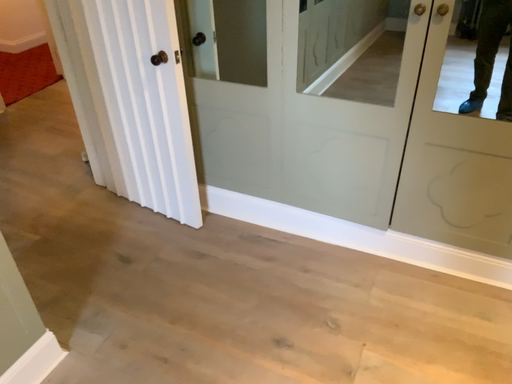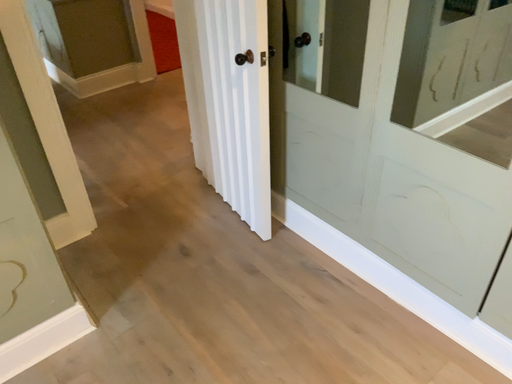
Question: How did the camera likely rotate when shooting the video?

Choices:
 (A) rotated left
 (B) rotated right

Answer: (A)